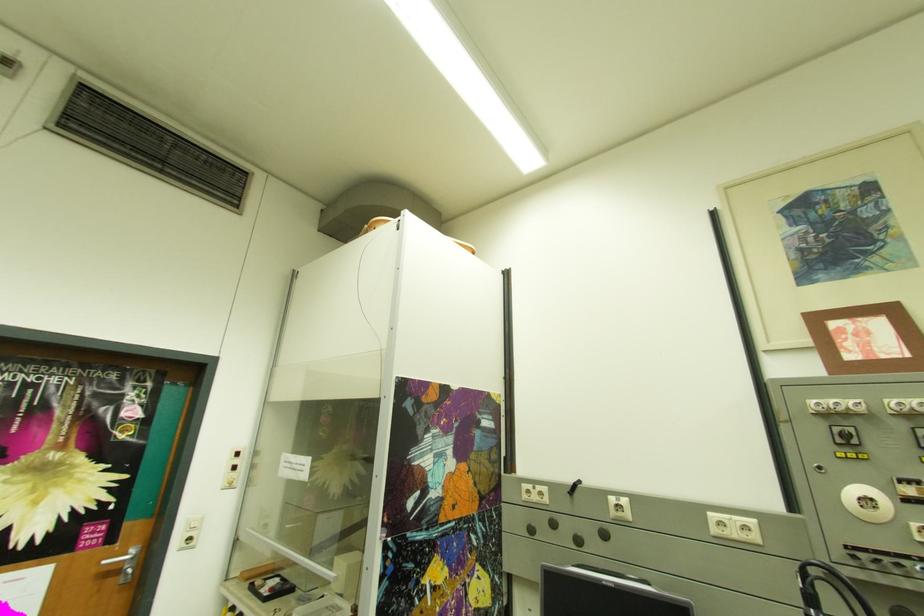
This screenshot has width=924, height=616. What do you see at coordinates (850, 455) in the screenshot? I see `the yellow push button` at bounding box center [850, 455].